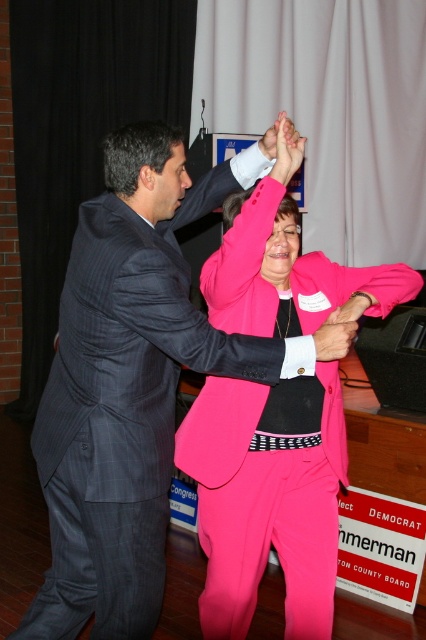
Based on the scene description, where is the dark gray pinstripe suit at center located in terms of its 2D coordinates?

The dark gray pinstripe suit at center is located at the 2D coordinates point (129, 385).

You are a photographer at a formal event. You need to position two subjects wearing the dark gray pinstripe suit at center and the pink matte suit at center so that both fit comfortably in the frame. Given their sizes, which subject should you place closer to the camera to avoid cropping?

The dark gray pinstripe suit at center is larger in size than the pink matte suit at center, so you should place the larger dark gray pinstripe suit at center closer to the camera to ensure it fits within the frame without cropping.

You are a photographer at a formal event. You want to take a photo of both the dark gray pinstripe suit at center and the matte pink sleeve at upper center. Which one should you focus on first to ensure both are in sharp focus?

You should focus on the dark gray pinstripe suit at center first because it is closer to the viewer than the matte pink sleeve at upper center, so focusing on the closer object will help both be in focus.